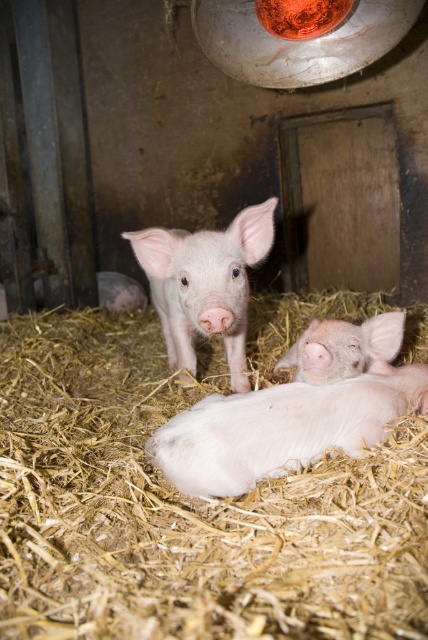
Question: Observing the image, what is the correct spatial positioning of light brown straw at center in reference to pink soft fur piglet at center?

Choices:
 (A) above
 (B) below

Answer: (B)

Question: Based on their relative distances, which object is nearer to the pink soft fur piglet at center?

Choices:
 (A) pink soft fur pig at center
 (B) light brown straw at center

Answer: (B)

Question: Does pink soft fur pig at center have a greater width compared to pink soft fur piglet at center?

Choices:
 (A) no
 (B) yes

Answer: (A)

Question: Can you confirm if light brown straw at center is wider than white soft pig at lower center?

Choices:
 (A) no
 (B) yes

Answer: (B)

Question: Which of the following is the closest to the observer?

Choices:
 (A) (8, 337)
 (B) (348, 397)
 (C) (377, 323)
 (D) (231, 225)

Answer: (B)

Question: Which point appears farthest from the camera in this image?

Choices:
 (A) (222, 307)
 (B) (71, 477)
 (C) (303, 433)
 (D) (133, 298)

Answer: (D)